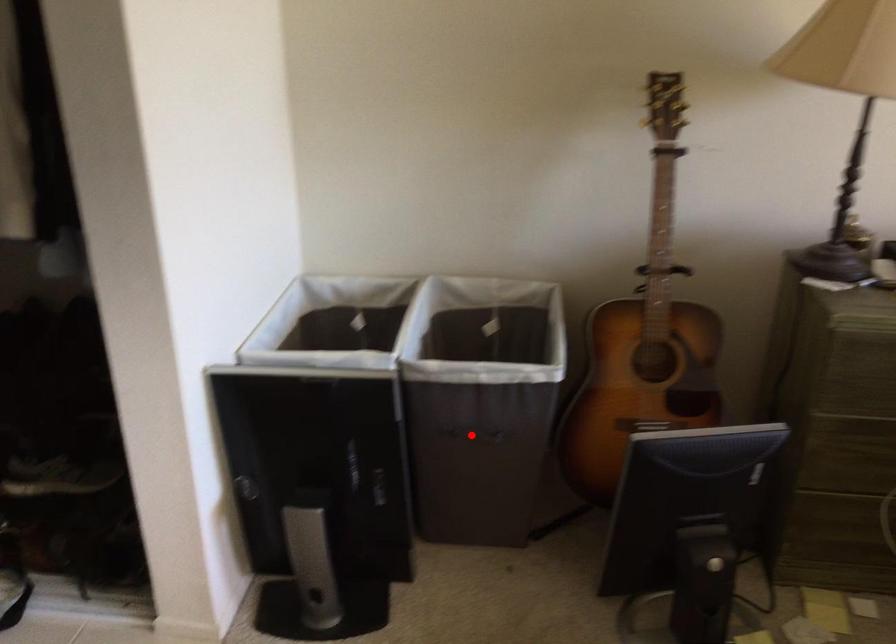
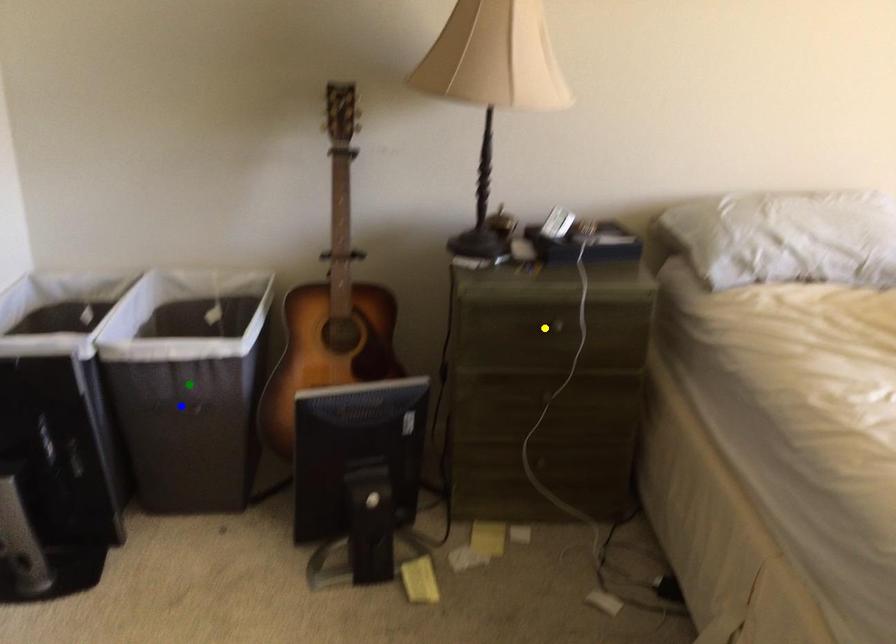
Question: I am providing you with two images of the same scene from different viewpoints. A red point is marked on the first image. You are given multiple points on the second image. Which point in image 2 represents the same 3d spot as the red point in image 1?

Choices:
 (A) green point
 (B) blue point
 (C) yellow point

Answer: (B)